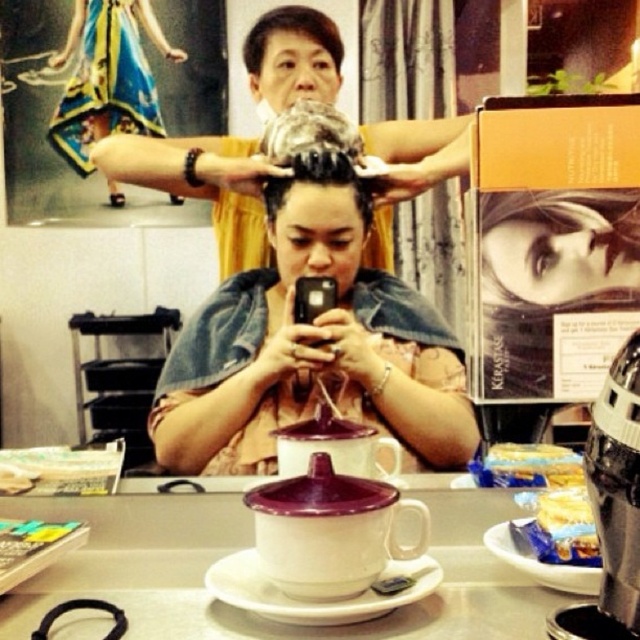
Between point (384, 189) and point (627, 396), which one is positioned behind?

The point (384, 189) is more distant.

Consider the image. Between matte black phone at center and metallic silver coffee machine at lower right, which one has more height?

With more height is matte black phone at center.

Does point (394, 182) come in front of point (632, 364)?

No, it is not.

This screenshot has width=640, height=640. I want to click on matte black phone at center, so tap(200, 184).

Which is in front, point (250, 202) or point (332, 19)?

Positioned in front is point (332, 19).

Is matte black phone at center wider than short hair at upper center?

Correct, the width of matte black phone at center exceeds that of short hair at upper center.

I want to click on matte black phone at center, so click(200, 184).

Where is `matte black phone at center`? The image size is (640, 640). matte black phone at center is located at coordinates (200, 184).

Who is positioned more to the left, denim jacket at center or short hair at upper center?

short hair at upper center is more to the left.

Who is more distant from viewer, (241, 369) or (276, 22)?

Positioned behind is point (241, 369).

Is point (324, 224) in front of point (330, 28)?

No, it is behind (330, 28).

The width and height of the screenshot is (640, 640). Identify the location of denim jacket at center. (308, 326).